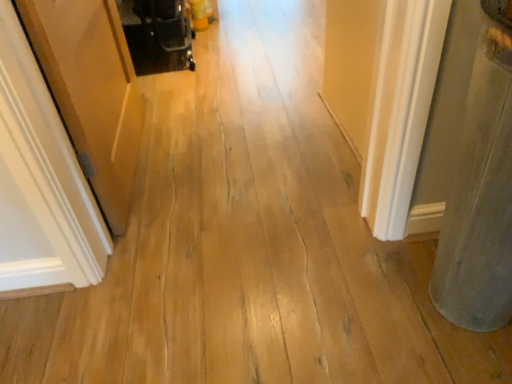
In order to face black plastic baby carriage at upper left, should I rotate leftwards or rightwards?

Rotate left and turn 12.701 degrees.

What is the approximate height of black plastic baby carriage at upper left?

13.61 inches.

In order to face gray felt pillow at right, should I rotate leftwards or rightwards?

To face it directly, rotate right by 30.493 degrees.

You are a GUI agent. You are given a task and a screenshot of the screen. Output one action in this format:
    pyautogui.click(x=<x>, y=<y>)
    Task: Click on the black plastic baby carriage at upper left
    The image size is (512, 384).
    Given the screenshot: What is the action you would take?
    pos(157,35)

Between point (480, 226) and point (154, 37), which one is positioned behind?

The point (154, 37) is farther.

Image resolution: width=512 pixels, height=384 pixels. In order to click on pillar that appears on the right of black plastic baby carriage at upper left in this screenshot , I will do `click(481, 190)`.

Which object is more forward, gray felt pillow at right or black plastic baby carriage at upper left?

gray felt pillow at right is more forward.

From the image's perspective, is gray felt pillow at right under black plastic baby carriage at upper left?

Yes.

Looking at the image, does black plastic baby carriage at upper left seem bigger or smaller compared to wooden door at left?

In the image, black plastic baby carriage at upper left appears to be smaller than wooden door at left.

From a real-world perspective, who is located lower, black plastic baby carriage at upper left or wooden door at left?

In real-world perspective, black plastic baby carriage at upper left is lower.

Between black plastic baby carriage at upper left and wooden door at left, which one is positioned behind?

Positioned behind is black plastic baby carriage at upper left.

Based on the photo, is black plastic baby carriage at upper left taller or shorter than wooden door at left?

Clearly, black plastic baby carriage at upper left is shorter compared to wooden door at left.

The height and width of the screenshot is (384, 512). I want to click on baby carriage that appears below the gray felt pillow at right (from a real-world perspective), so click(x=157, y=35).

Is black plastic baby carriage at upper left inside the boundaries of gray felt pillow at right, or outside?

black plastic baby carriage at upper left cannot be found inside gray felt pillow at right.

From a real-world perspective, is black plastic baby carriage at upper left over gray felt pillow at right?

No, from a real-world perspective, black plastic baby carriage at upper left is not on top of gray felt pillow at right.

Would you say black plastic baby carriage at upper left is to the left or to the right of gray felt pillow at right in the picture?

Based on their positions, black plastic baby carriage at upper left is located to the left of gray felt pillow at right.

From the image's perspective, is wooden door at left under black plastic baby carriage at upper left?

Yes, from the image's perspective, wooden door at left is beneath black plastic baby carriage at upper left.

Is wooden door at left far from black plastic baby carriage at upper left?

That's right, there is a large distance between wooden door at left and black plastic baby carriage at upper left.

Does wooden door at left have a lesser height compared to black plastic baby carriage at upper left?

No, wooden door at left is not shorter than black plastic baby carriage at upper left.

Is wooden door at left smaller than black plastic baby carriage at upper left?

Actually, wooden door at left might be larger than black plastic baby carriage at upper left.

Can we say wooden door at left lies outside gray felt pillow at right?

Yes, wooden door at left is not within gray felt pillow at right.

Is wooden door at left in contact with gray felt pillow at right?

They are not placed beside each other.

How different are the orientations of wooden door at left and gray felt pillow at right in degrees?

The angle between the facing direction of wooden door at left and the facing direction of gray felt pillow at right is 88.7 degrees.

Is gray felt pillow at right taller or shorter than wooden door at left?

Considering their sizes, gray felt pillow at right has more height than wooden door at left.

Looking at their sizes, would you say gray felt pillow at right is wider or thinner than wooden door at left?

gray felt pillow at right is wider than wooden door at left.

From the picture: Is wooden door at left at the back of gray felt pillow at right?

That's not correct — gray felt pillow at right is not looking away from wooden door at left.

In order to click on baby carriage that is under the gray felt pillow at right (from a real-world perspective) in this screenshot , I will do `click(157, 35)`.

Where is `baby carriage on the right side of wooden door at left`? The height and width of the screenshot is (384, 512). baby carriage on the right side of wooden door at left is located at coordinates (157, 35).

Looking at the image, which one is located closer to wooden door at left, black plastic baby carriage at upper left or gray felt pillow at right?

gray felt pillow at right.

When comparing their distances from gray felt pillow at right, does black plastic baby carriage at upper left or wooden door at left seem closer?

wooden door at left is closer to gray felt pillow at right.

Considering their positions, is gray felt pillow at right positioned closer to wooden door at left than black plastic baby carriage at upper left?

gray felt pillow at right lies closer to wooden door at left than the other object.

From the image, which object appears to be nearer to gray felt pillow at right, wooden door at left or black plastic baby carriage at upper left?

wooden door at left is closer to gray felt pillow at right.

From the image, which object appears to be nearer to black plastic baby carriage at upper left, wooden door at left or gray felt pillow at right?

wooden door at left.

When comparing their distances from black plastic baby carriage at upper left, does gray felt pillow at right or wooden door at left seem further?

gray felt pillow at right is further to black plastic baby carriage at upper left.

Where is `door between gray felt pillow at right and black plastic baby carriage at upper left from front to back`? door between gray felt pillow at right and black plastic baby carriage at upper left from front to back is located at coordinates (41, 181).